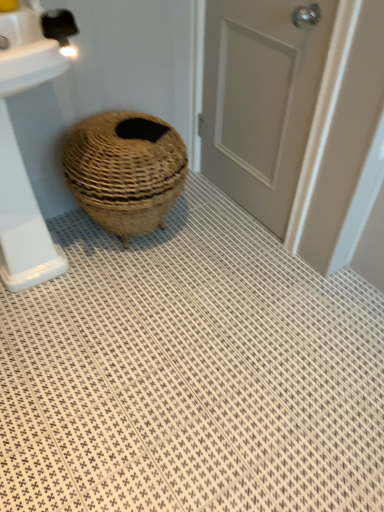
Identify the location of vacant space underneath natural woven basket at center (from a real-world perspective). (135, 242).